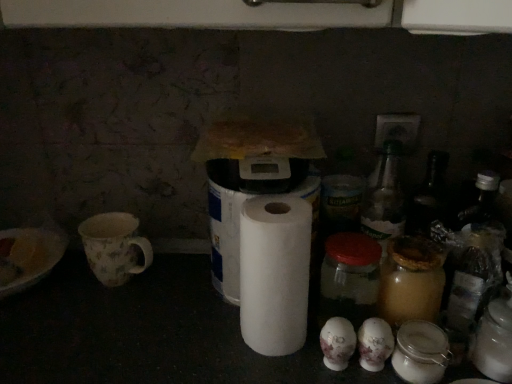
Question: Which direction should I rotate to face white matte toilet paper at lower center, positioned as the second toilet paper in right-to-left order, — up or down?

Choices:
 (A) down
 (B) up

Answer: (A)

Question: From the image's perspective, is transparent glass jar at center on top of white matte toilet paper at lower center, acting as the second toilet paper starting from the left?

Choices:
 (A) no
 (B) yes

Answer: (B)

Question: From a real-world perspective, is transparent glass jar at center on top of white matte toilet paper at lower center, positioned as the second toilet paper in right-to-left order?

Choices:
 (A) no
 (B) yes

Answer: (B)

Question: Can you confirm if transparent glass jar at center is wider than white matte toilet paper at lower center, positioned as the second toilet paper in right-to-left order?

Choices:
 (A) yes
 (B) no

Answer: (A)

Question: Does transparent glass jar at center appear on the left side of white matte toilet paper at lower center, acting as the second toilet paper starting from the left?

Choices:
 (A) no
 (B) yes

Answer: (A)

Question: Is transparent glass jar at center shorter than white matte toilet paper at lower center, acting as the second toilet paper starting from the left?

Choices:
 (A) no
 (B) yes

Answer: (A)

Question: Is transparent glass jar at center to the right of white matte toilet paper at lower center, positioned as the second toilet paper in right-to-left order, from the viewer's perspective?

Choices:
 (A) no
 (B) yes

Answer: (B)

Question: Could transparent glass jar at center be considered to be inside white matte toilet paper at center, the first toilet paper positioned from the left?

Choices:
 (A) yes
 (B) no

Answer: (B)

Question: Is white matte toilet paper at center, the third toilet paper positioned from the right, looking in the opposite direction of transparent glass jar at center?

Choices:
 (A) no
 (B) yes

Answer: (A)

Question: Is white matte toilet paper at center, the third toilet paper positioned from the right, at the right side of transparent glass jar at center?

Choices:
 (A) yes
 (B) no

Answer: (B)

Question: Can you confirm if white matte toilet paper at center, the third toilet paper positioned from the right, is smaller than transparent glass jar at center?

Choices:
 (A) no
 (B) yes

Answer: (A)

Question: Does white matte toilet paper at center, the first toilet paper positioned from the left, turn towards transparent glass jar at center?

Choices:
 (A) yes
 (B) no

Answer: (B)

Question: Is the position of white matte toilet paper at center, the first toilet paper positioned from the left, more distant than that of transparent glass jar at center?

Choices:
 (A) yes
 (B) no

Answer: (A)

Question: From the image's perspective, does white matte toilet paper at lower center, positioned as the second toilet paper in right-to-left order, appear higher than white paper at center?

Choices:
 (A) no
 (B) yes

Answer: (A)